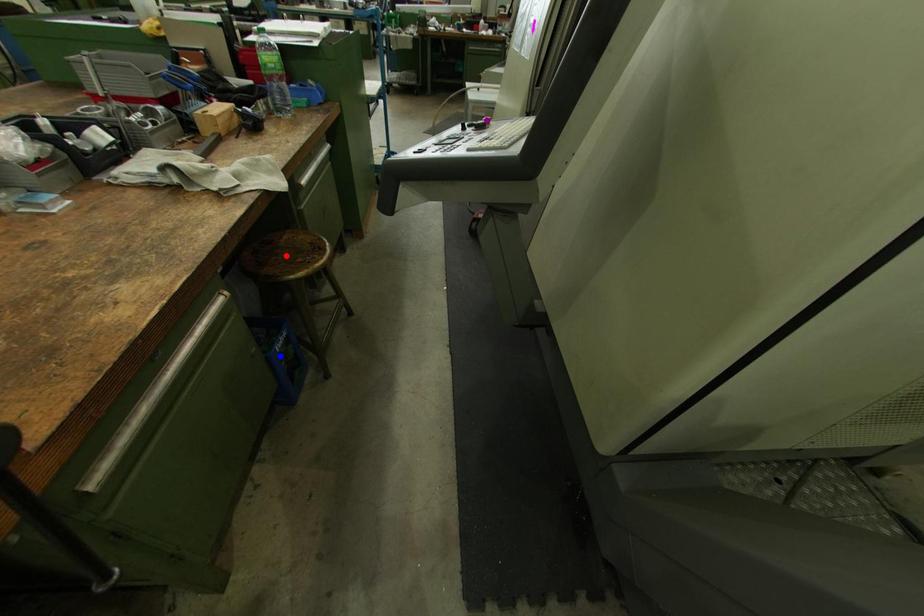
Consider the image. Order these from nearest to farthest:
- blue point
- purple point
- red point

1. purple point
2. red point
3. blue point